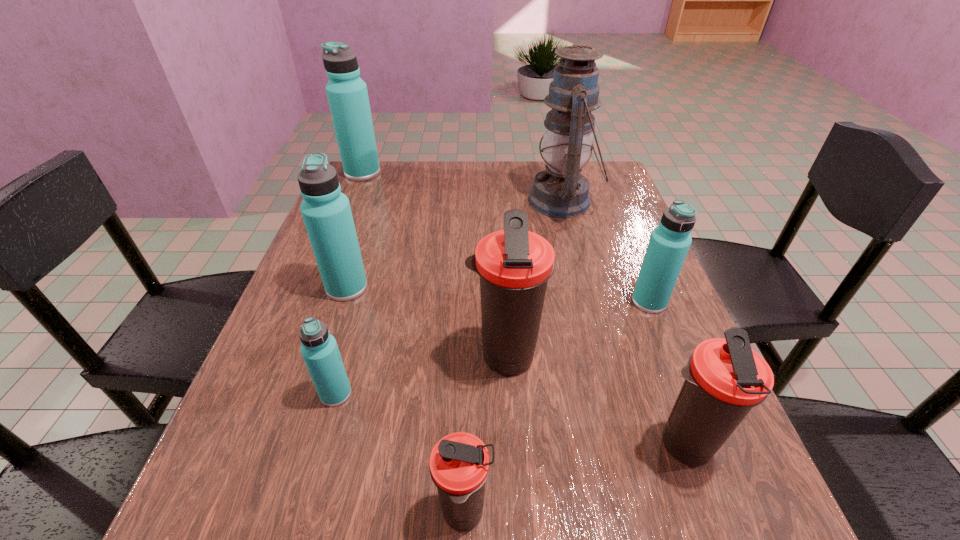
At what (x,y) coordinates should I click in order to perform the action: click on free spot that satisfies the following two spatial constraints: 1. on the back side of the rightmost brown thermos bottle; 2. on the left side of the third biggest aqua thermos bottle. Please return your answer as a coordinate pair (x, y). Image resolution: width=960 pixels, height=540 pixels. Looking at the image, I should click on (632, 302).